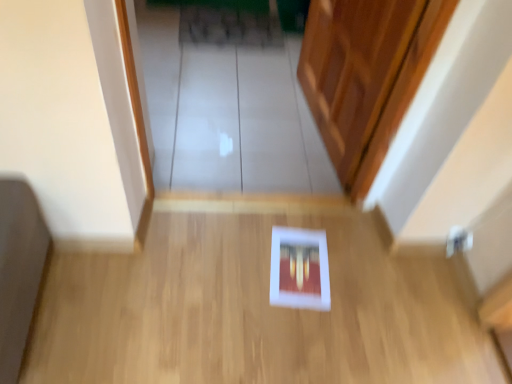
Question: Is transparent glass door at center facing towards white matte book at center?

Choices:
 (A) yes
 (B) no

Answer: (A)

Question: Can you confirm if transparent glass door at center is bigger than white matte book at center?

Choices:
 (A) yes
 (B) no

Answer: (B)

Question: Can we say transparent glass door at center lies outside white matte book at center?

Choices:
 (A) no
 (B) yes

Answer: (B)

Question: From the image's perspective, is transparent glass door at center below white matte book at center?

Choices:
 (A) yes
 (B) no

Answer: (B)

Question: Is transparent glass door at center to the right of white matte book at center from the viewer's perspective?

Choices:
 (A) no
 (B) yes

Answer: (A)

Question: Is there a large distance between transparent glass door at center and white matte book at center?

Choices:
 (A) yes
 (B) no

Answer: (B)

Question: Considering the relative positions of white matte book at center and transparent glass door at center in the image provided, is white matte book at center to the right of transparent glass door at center from the viewer's perspective?

Choices:
 (A) yes
 (B) no

Answer: (A)

Question: Is white matte book at center behind transparent glass door at center?

Choices:
 (A) no
 (B) yes

Answer: (A)

Question: From a real-world perspective, is white matte book at center under transparent glass door at center?

Choices:
 (A) no
 (B) yes

Answer: (A)

Question: Considering the relative sizes of white matte book at center and transparent glass door at center in the image provided, is white matte book at center bigger than transparent glass door at center?

Choices:
 (A) yes
 (B) no

Answer: (A)

Question: Is the surface of white matte book at center in direct contact with transparent glass door at center?

Choices:
 (A) no
 (B) yes

Answer: (A)

Question: Can you confirm if white matte book at center is positioned to the left of transparent glass door at center?

Choices:
 (A) no
 (B) yes

Answer: (A)

Question: Looking at their shapes, would you say white matte book at center is wider or thinner than transparent glass door at center?

Choices:
 (A) thin
 (B) wide

Answer: (A)